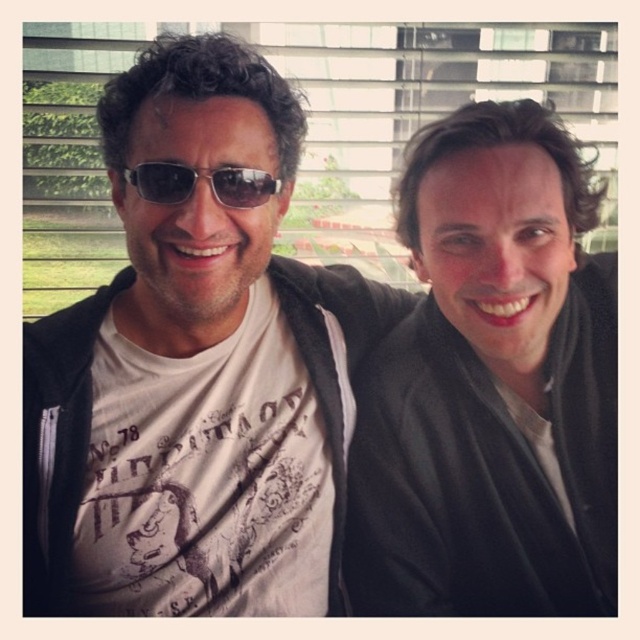
Question: Which of the following is the farthest from the observer?

Choices:
 (A) matte black jacket at left
 (B) black plastic sunglasses at center

Answer: (B)

Question: Does matte black jacket at left have a smaller size compared to black plastic sunglasses at center?

Choices:
 (A) yes
 (B) no

Answer: (B)

Question: Is matte black jacket at center to the right of black plastic sunglasses at center from the viewer's perspective?

Choices:
 (A) yes
 (B) no

Answer: (A)

Question: Which of these objects is positioned farthest from the matte black jacket at left?

Choices:
 (A) black plastic sunglasses at center
 (B) matte black jacket at center

Answer: (A)

Question: Is matte black jacket at left closer to camera compared to matte black jacket at center?

Choices:
 (A) yes
 (B) no

Answer: (A)

Question: Which point is farther to the camera?

Choices:
 (A) matte black jacket at center
 (B) matte black jacket at left
 (C) black plastic sunglasses at center

Answer: (A)